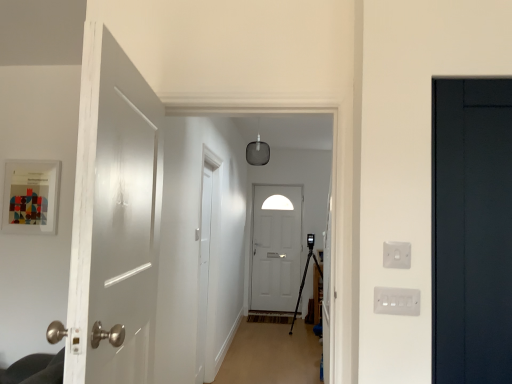
You are a GUI agent. You are given a task and a screenshot of the screen. Output one action in this format:
    pyautogui.click(x=<x>, y=<y>)
    Task: Click on the white plastic electric outlet at right, positioned as the 1th electric outlet in top-to-bottom order
    The image size is (512, 384).
    Given the screenshot: What is the action you would take?
    pyautogui.click(x=397, y=255)

The height and width of the screenshot is (384, 512). What do you see at coordinates (396, 301) in the screenshot?
I see `white plastic switch at right, which is the 2th electric outlet from top to bottom` at bounding box center [396, 301].

Where is `wooden floor at center`? This screenshot has height=384, width=512. wooden floor at center is located at coordinates (271, 353).

The image size is (512, 384). Find the location of `dark wood door at right, arranged as the 1th door when viewed from the right`. dark wood door at right, arranged as the 1th door when viewed from the right is located at coordinates (472, 230).

You are a GUI agent. You are given a task and a screenshot of the screen. Output one action in this format:
    pyautogui.click(x=<x>, y=<y>)
    Task: Click on the white plastic electric outlet at right, positioned as the 1th electric outlet in top-to-bottom order
    The image size is (512, 384).
    Given the screenshot: What is the action you would take?
    pyautogui.click(x=397, y=255)

How many degrees apart are the facing directions of white plastic switch at right, which is the 2th electric outlet from top to bottom, and white plastic electric outlet at right, positioned as the 1th electric outlet in top-to-bottom order?

The angle between the facing direction of white plastic switch at right, which is the 2th electric outlet from top to bottom, and the facing direction of white plastic electric outlet at right, positioned as the 1th electric outlet in top-to-bottom order, is 0.708 degrees.

In the scene shown: Which point is more forward, (418, 297) or (386, 256)?

The point (418, 297) is in front.

Considering the relative sizes of white plastic switch at right, arranged as the 1th electric outlet when ordered from the bottom, and white plastic electric outlet at right, which is the 2th electric outlet from bottom to top, in the image provided, is white plastic switch at right, arranged as the 1th electric outlet when ordered from the bottom, taller than white plastic electric outlet at right, which is the 2th electric outlet from bottom to top,?

Yes.

Could wooden floor at center be considered to be inside white glossy door at left, which appears as the 1th door when viewed from the front?

No, wooden floor at center is not a part of white glossy door at left, which appears as the 1th door when viewed from the front.

Considering the relative sizes of white glossy door at left, the 3th door viewed from the right, and wooden floor at center in the image provided, is white glossy door at left, the 3th door viewed from the right, wider than wooden floor at center?

Incorrect, the width of white glossy door at left, the 3th door viewed from the right, does not surpass that of wooden floor at center.

From a real-world perspective, which is physically above, white glossy door at left, which appears as the 1th door when viewed from the front, or wooden floor at center?

white glossy door at left, which appears as the 1th door when viewed from the front, is physically above.

Is point (150, 183) less distant than point (317, 345)?

Yes, point (150, 183) is closer to viewer.

Does dark wood door at right, the second door in the front-to-back sequence, come in front of white plastic switch at right, which is the 2th electric outlet from top to bottom?

That is True.

Is dark wood door at right, the 3th door in the left-to-right sequence, spatially inside white plastic switch at right, which is the 2th electric outlet from top to bottom, or outside of it?

The correct answer is: outside.

Is dark wood door at right, arranged as the 1th door when viewed from the right, looking in the opposite direction of white plastic switch at right, arranged as the 1th electric outlet when ordered from the bottom?

No.

Does dark wood door at right, the 2th door positioned from the back, have a greater height compared to white plastic switch at right, arranged as the 1th electric outlet when ordered from the bottom?

Indeed, dark wood door at right, the 2th door positioned from the back, has a greater height compared to white plastic switch at right, arranged as the 1th electric outlet when ordered from the bottom.

How many degrees apart are the facing directions of white plastic electric outlet at right, positioned as the 1th electric outlet in top-to-bottom order, and white glossy door at left, the 3th door viewed from the right?

white plastic electric outlet at right, positioned as the 1th electric outlet in top-to-bottom order, and white glossy door at left, the 3th door viewed from the right, are facing 97 degrees away from each other.

Would you say white plastic electric outlet at right, which is the 2th electric outlet from bottom to top, is outside white glossy door at left, the first door when ordered from left to right?

white plastic electric outlet at right, which is the 2th electric outlet from bottom to top, is positioned outside white glossy door at left, the first door when ordered from left to right.

Is point (386, 242) closer or farther from the camera than point (131, 92)?

Point (386, 242) is positioned farther from the camera compared to point (131, 92).

In the scene shown: How far apart are white plastic electric outlet at right, positioned as the 1th electric outlet in top-to-bottom order, and white glossy door at left, the first door when ordered from left to right?

They are 35.18 inches apart.

Does white plastic electric outlet at right, which is the 2th electric outlet from bottom to top, have a lesser width compared to wooden floor at center?

Indeed, white plastic electric outlet at right, which is the 2th electric outlet from bottom to top, has a lesser width compared to wooden floor at center.

Is white plastic electric outlet at right, which is the 2th electric outlet from bottom to top, facing away from wooden floor at center?

Yes, white plastic electric outlet at right, which is the 2th electric outlet from bottom to top, is facing away from wooden floor at center.

Is white plastic electric outlet at right, which is the 2th electric outlet from bottom to top, positioned before wooden floor at center?

Yes, it is in front of wooden floor at center.

Does white plastic electric outlet at right, which is the 2th electric outlet from bottom to top, have a greater height compared to wooden floor at center?

Incorrect, the height of white plastic electric outlet at right, which is the 2th electric outlet from bottom to top, is not larger of that of wooden floor at center.

How many degrees apart are the facing directions of white glossy door at left, the first door when ordered from left to right, and white matte door at center, acting as the first door starting from the back?

The angle between the facing direction of white glossy door at left, the first door when ordered from left to right, and the facing direction of white matte door at center, acting as the first door starting from the back, is 97.7 degrees.

Considering the points (122, 334) and (275, 224), which point is behind, point (122, 334) or point (275, 224)?

The point (275, 224) is more distant.

From a real-world perspective, which object rests below the other?

white matte door at center, acting as the first door starting from the back, is physically lower.

At what (x,y) coordinates should I click in order to perform the action: click on door on the left side of white matte door at center, the 3th door from the front. Please return your answer as a coordinate pair (x, y). This screenshot has width=512, height=384. Looking at the image, I should click on (113, 221).

Considering the sizes of objects white plastic switch at right, which is the 2th electric outlet from top to bottom, and white matte door at center, which appears as the 2th door when viewed from the right, in the image provided, who is shorter, white plastic switch at right, which is the 2th electric outlet from top to bottom, or white matte door at center, which appears as the 2th door when viewed from the right,?

With less height is white plastic switch at right, which is the 2th electric outlet from top to bottom.

Is white plastic switch at right, arranged as the 1th electric outlet when ordered from the bottom, positioned beyond the bounds of white matte door at center, the 3th door from the front?

Indeed, white plastic switch at right, arranged as the 1th electric outlet when ordered from the bottom, is completely outside white matte door at center, the 3th door from the front.

Is white plastic switch at right, which is the 2th electric outlet from top to bottom, wider or thinner than white matte door at center, which appears as the second door when viewed from the left?

Clearly, white plastic switch at right, which is the 2th electric outlet from top to bottom, has less width compared to white matte door at center, which appears as the second door when viewed from the left.

How different are the orientations of white plastic switch at right, which is the 2th electric outlet from top to bottom, and white matte door at center, acting as the first door starting from the back, in degrees?

The angular difference between white plastic switch at right, which is the 2th electric outlet from top to bottom, and white matte door at center, acting as the first door starting from the back, is 0.0332 degrees.

This screenshot has width=512, height=384. What are the coordinates of `electric outlet directly beneath the white plastic electric outlet at right, positioned as the 1th electric outlet in top-to-bottom order (from a real-world perspective)` in the screenshot? It's located at (396, 301).

Image resolution: width=512 pixels, height=384 pixels. I want to click on door that is the 2nd object located above the wooden floor at center (from the image's perspective), so (113, 221).

Considering their positions, is wooden floor at center positioned closer to white matte door at center, which appears as the second door when viewed from the left, than white plastic switch at right, which is the 2th electric outlet from top to bottom?

The object closer to white matte door at center, which appears as the second door when viewed from the left, is wooden floor at center.

Which object lies further to the anchor point white plastic switch at right, arranged as the 1th electric outlet when ordered from the bottom, white glossy door at left, the 3th door viewed from the right, or wooden floor at center?

wooden floor at center is positioned further to the anchor white plastic switch at right, arranged as the 1th electric outlet when ordered from the bottom.

Estimate the real-world distances between objects in this image. Which object is closer to white matte door at center, the 3th door from the front, wooden floor at center or dark wood door at right, the 3th door in the left-to-right sequence?

The object closer to white matte door at center, the 3th door from the front, is wooden floor at center.

From the image, which object appears to be nearer to white matte door at center, acting as the first door starting from the back, dark wood door at right, the 2th door positioned from the back, or wooden floor at center?

Among the two, wooden floor at center is located nearer to white matte door at center, acting as the first door starting from the back.

From the image, which object appears to be nearer to white plastic electric outlet at right, which is the 2th electric outlet from bottom to top, dark wood door at right, arranged as the 1th door when viewed from the right, or white glossy door at left, which appears as the 1th door when viewed from the front?

dark wood door at right, arranged as the 1th door when viewed from the right.

Which object lies nearer to the anchor point white plastic switch at right, which is the 2th electric outlet from top to bottom, white glossy door at left, the 3th door viewed from the right, or dark wood door at right, the 3th door in the left-to-right sequence?

dark wood door at right, the 3th door in the left-to-right sequence.

Considering their positions, is white matte door at center, which appears as the second door when viewed from the left, positioned further to white plastic switch at right, which is the 2th electric outlet from top to bottom, than wooden floor at center?

white matte door at center, which appears as the second door when viewed from the left, is positioned further to the anchor white plastic switch at right, which is the 2th electric outlet from top to bottom.

Looking at the image, which one is located closer to white plastic electric outlet at right, which is the 2th electric outlet from bottom to top, dark wood door at right, the 3th door in the left-to-right sequence, or wooden floor at center?

dark wood door at right, the 3th door in the left-to-right sequence.

Identify the location of electric outlet between white plastic switch at right, which is the 2th electric outlet from top to bottom, and dark wood door at right, the 2th door positioned from the back, from left to right. The width and height of the screenshot is (512, 384). (397, 255).

Where is `plain located between dark wood door at right, arranged as the 1th door when viewed from the right, and white matte door at center, which appears as the 2th door when viewed from the right, in the depth direction`? The height and width of the screenshot is (384, 512). plain located between dark wood door at right, arranged as the 1th door when viewed from the right, and white matte door at center, which appears as the 2th door when viewed from the right, in the depth direction is located at coordinates (271, 353).

Locate an element on the screen. This screenshot has height=384, width=512. electric outlet located between white plastic switch at right, arranged as the 1th electric outlet when ordered from the bottom, and white matte door at center, which appears as the second door when viewed from the left, in the depth direction is located at coordinates (397, 255).

The height and width of the screenshot is (384, 512). I want to click on plain positioned between white plastic switch at right, which is the 2th electric outlet from top to bottom, and white matte door at center, which appears as the second door when viewed from the left, from near to far, so click(x=271, y=353).